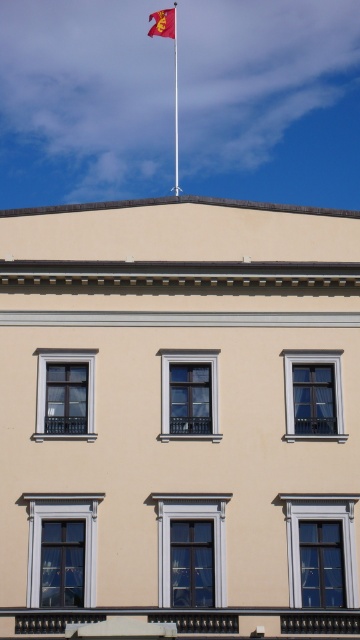
What do you see at coordinates (163, 22) in the screenshot?
I see `red fabric flag at upper center` at bounding box center [163, 22].

Measure the distance between red fabric flag at upper center and camera.

They are 545.42 feet apart.

You are a GUI agent. You are given a task and a screenshot of the screen. Output one action in this format:
    pyautogui.click(x=<x>, y=<y>)
    Task: Click on the red fabric flag at upper center
    
    Given the screenshot: What is the action you would take?
    pyautogui.click(x=163, y=22)

This screenshot has width=360, height=640. I want to click on red fabric flag at upper center, so click(x=163, y=22).